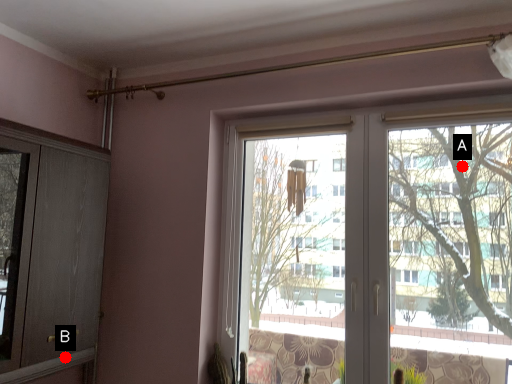
Question: Two points are circled on the image, labeled by A and B beside each circle. Which point is further to the camera?

Choices:
 (A) A is further
 (B) B is further

Answer: (A)